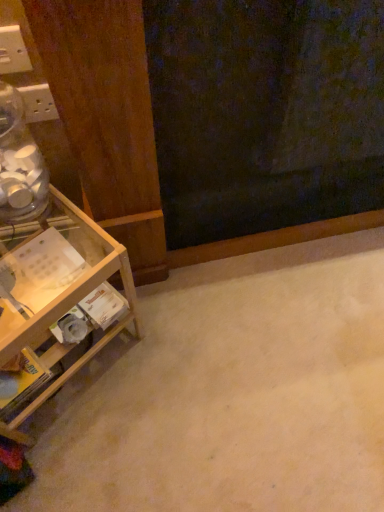
The height and width of the screenshot is (512, 384). I want to click on vacant space to the right of wooden shelf at left, so coord(177,370).